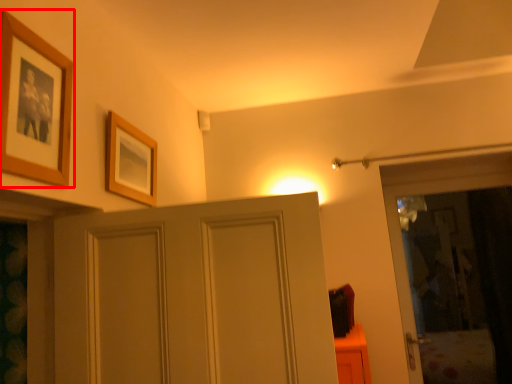
Question: Where is picture frame (annotated by the red box) located in relation to picture frame in the image?

Choices:
 (A) left
 (B) right

Answer: (A)